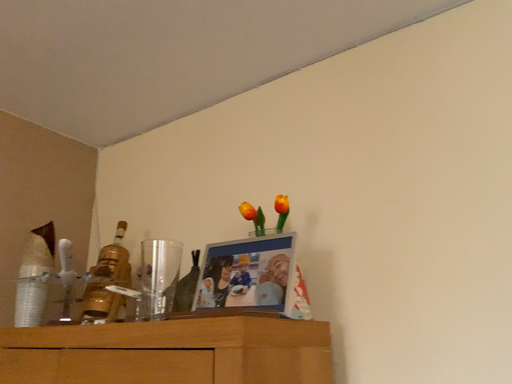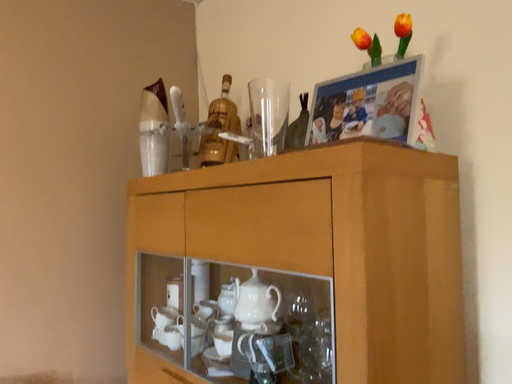
Question: Which way did the camera rotate in the video?

Choices:
 (A) rotated upward
 (B) rotated downward

Answer: (B)